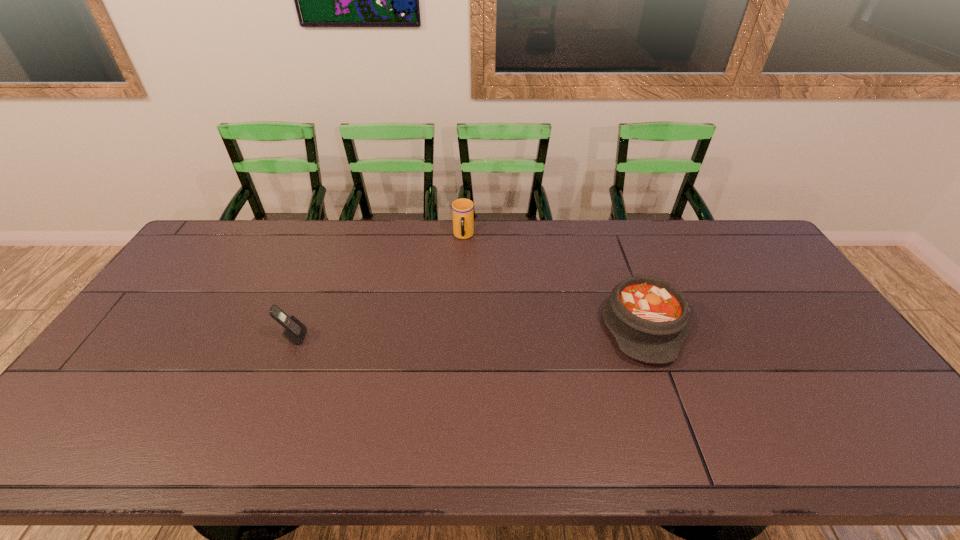
Identify the location of vacant region between the second object from left to right and the casserole. Image resolution: width=960 pixels, height=540 pixels. (553, 280).

The width and height of the screenshot is (960, 540). Find the location of `empty space that is in between the leftmost object and the cup`. empty space that is in between the leftmost object and the cup is located at coordinates (x=378, y=287).

What are the coordinates of `free area in between the casserole and the leftmost object` in the screenshot? It's located at (468, 331).

Locate an element on the screen. free space between the second object from left to right and the casserole is located at coordinates (553, 280).

What are the coordinates of `the closest object to the leftmost object` in the screenshot? It's located at (462, 209).

Identify the location of the second closest object relative to the second object from left to right. coord(294,331).

The height and width of the screenshot is (540, 960). In order to click on blank area in the image that satisfies the following two spatial constraints: 1. on the side of the second object from left to right with the handle; 2. on the front-facing side of the cellular telephone in this screenshot , I will do `click(459, 337)`.

This screenshot has width=960, height=540. What are the coordinates of `vacant area that satisfies the following two spatial constraints: 1. on the side of the farthest object with the handle; 2. on the front-facing side of the leftmost object` in the screenshot? It's located at (459, 337).

I want to click on vacant area that satisfies the following two spatial constraints: 1. on the side of the farthest object with the handle; 2. on the front-facing side of the cellular telephone, so click(459, 337).

Find the location of a particular element. The image size is (960, 540). vacant area that satisfies the following two spatial constraints: 1. on the side of the casserole with the handle; 2. on the left side of the second object from right to left is located at coordinates (460, 325).